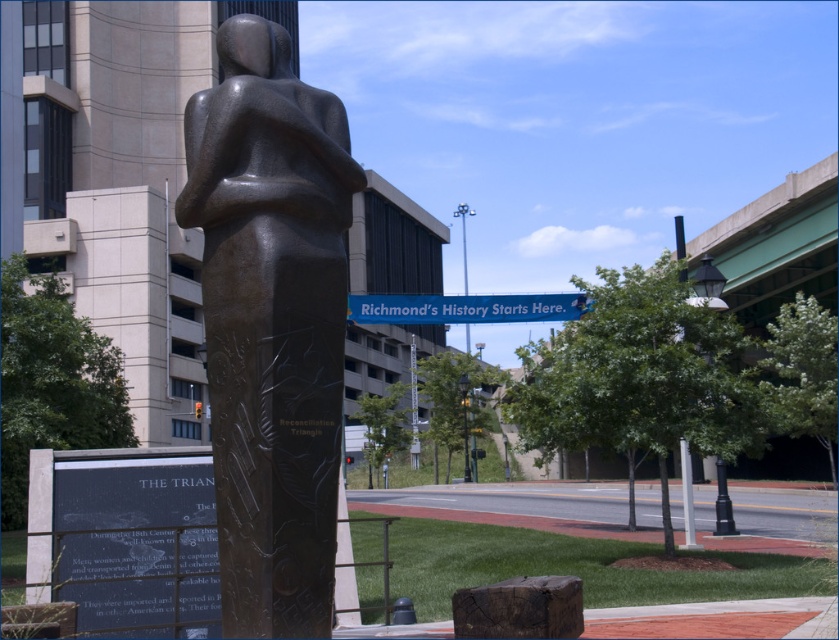
Question: Which object appears closest to the camera in this image?

Choices:
 (A) bronze statue at center
 (B) blue plastic banner at center

Answer: (A)

Question: Does bronze statue at center have a smaller size compared to blue plastic banner at center?

Choices:
 (A) yes
 (B) no

Answer: (A)

Question: Does bronze statue at center have a greater width compared to blue plastic banner at center?

Choices:
 (A) no
 (B) yes

Answer: (A)

Question: Which point is farther to the camera?

Choices:
 (A) blue plastic banner at center
 (B) bronze statue at center

Answer: (A)

Question: Where is bronze statue at center located in relation to blue plastic banner at center in the image?

Choices:
 (A) left
 (B) right

Answer: (A)